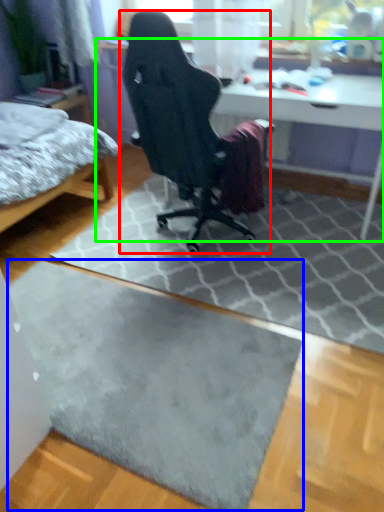
Question: Which object is positioned closest to chair (highlighted by a red box)? Select from doormat (highlighted by a blue box) and table (highlighted by a green box).

Choices:
 (A) doormat
 (B) table

Answer: (B)